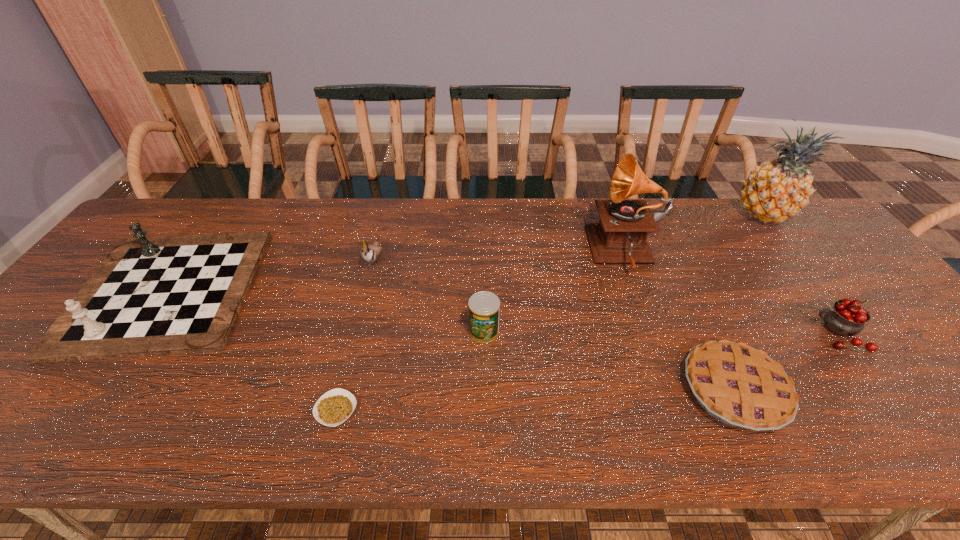
Where is `pineapple`? This screenshot has height=540, width=960. pineapple is located at coordinates (774, 191).

Find the location of a particular element. This screenshot has height=540, width=960. phonograph record is located at coordinates (620, 236).

Find the location of a particular element. Image resolution: width=960 pixels, height=540 pixels. the leftmost object is located at coordinates (151, 296).

Locate an element on the screen. bird is located at coordinates (370, 253).

I want to click on cherry, so click(847, 317).

Find the location of a particular element. can is located at coordinates (484, 307).

Image resolution: width=960 pixels, height=540 pixels. I want to click on the second shortest object, so click(741, 386).

Identify the location of legume. (334, 407).

I want to click on vacant space situated 0.380m on the left of the pineapple, so click(616, 215).

Locate an element on the screen. The height and width of the screenshot is (540, 960). vacant area situated on the horn of the phonograph record is located at coordinates (557, 252).